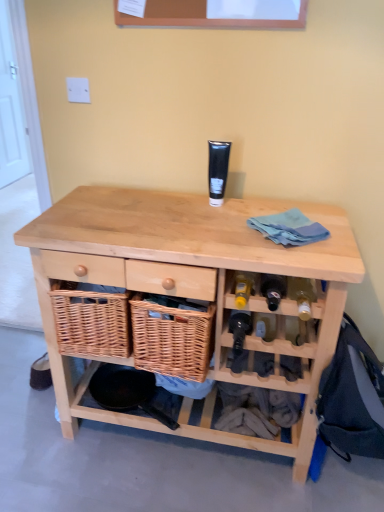
I want to click on empty space that is ontop of natural wood table at center (from a real-world perspective), so click(x=188, y=219).